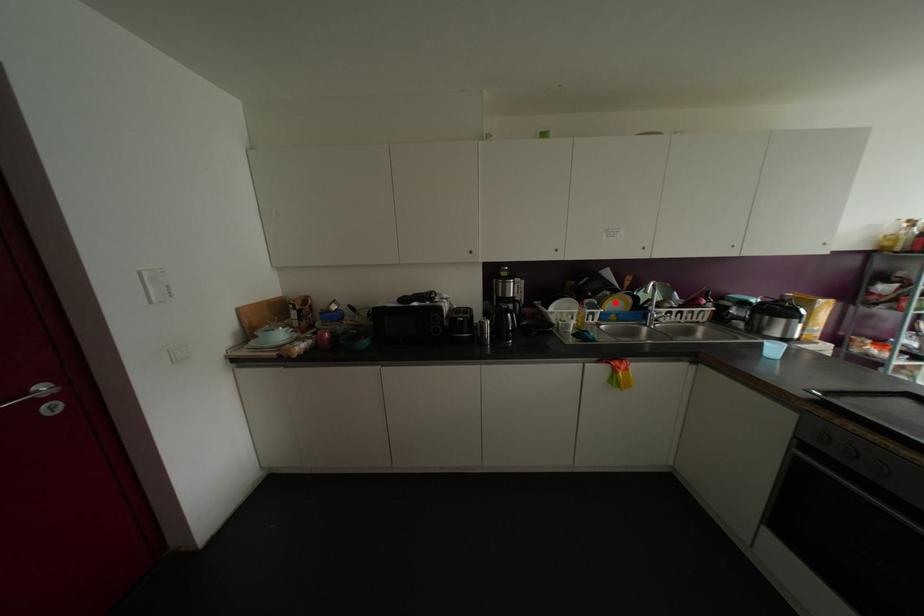
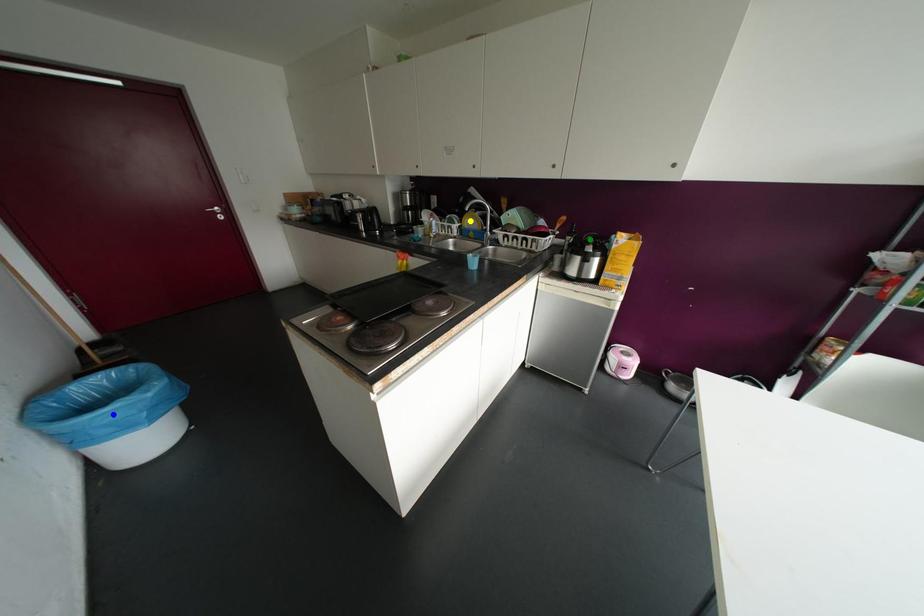
Question: I am providing you with two images of the same scene from different viewpoints. A red point is marked on the first image. You are given multiple points on the second image. Can you choose the point in image 2 that corresponds to the point in image 1?

Choices:
 (A) yellow point
 (B) green point
 (C) blue point

Answer: (A)